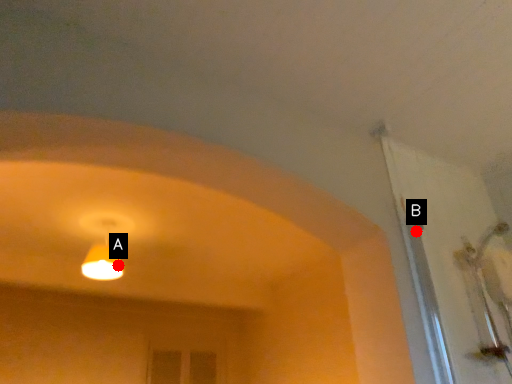
Question: Two points are circled on the image, labeled by A and B beside each circle. Which of the following is the farthest from the observer?

Choices:
 (A) A is further
 (B) B is further

Answer: (A)